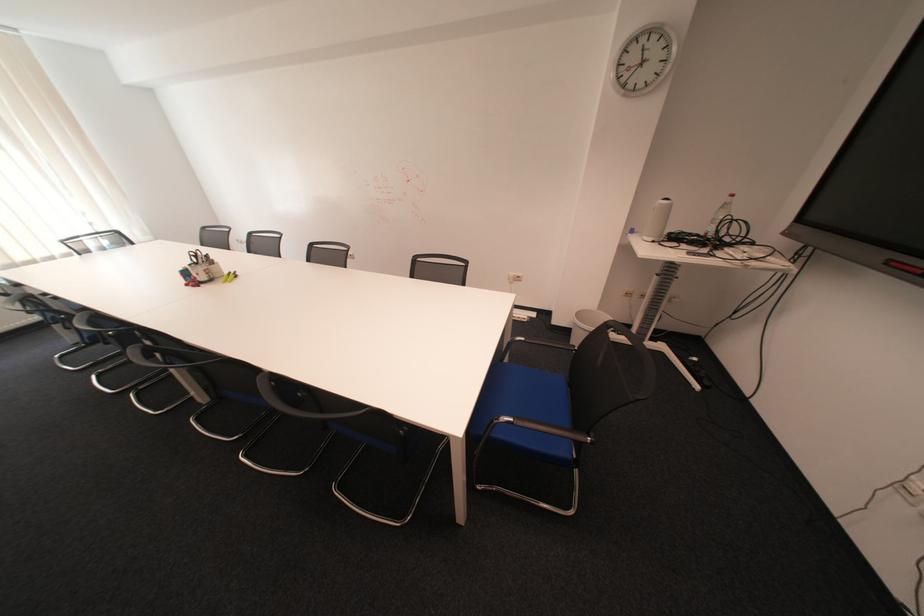
Where is `black chair armrest`? This screenshot has height=616, width=924. black chair armrest is located at coordinates (544, 428).